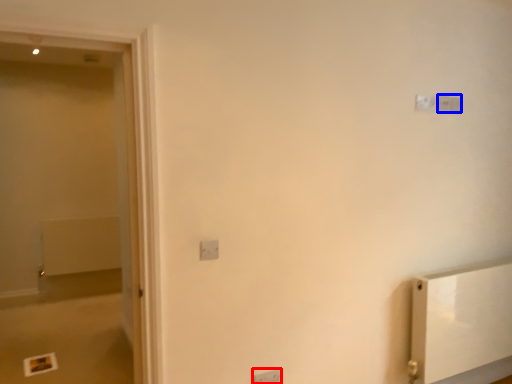
Question: Which object is closer to the camera taking this photo, light switch (highlighted by a red box) or light switch (highlighted by a blue box)?

Choices:
 (A) light switch
 (B) light switch

Answer: (A)